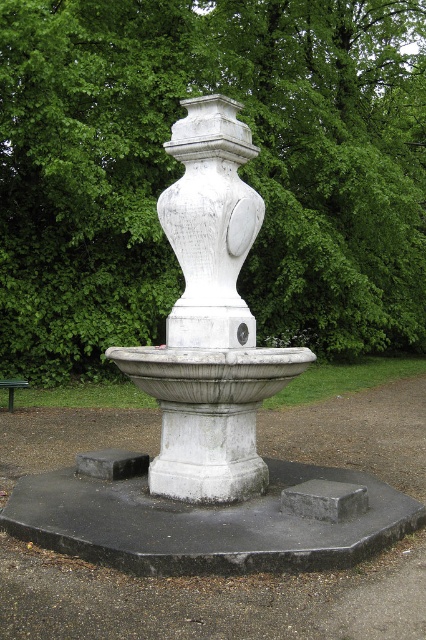
Is green leafy tree at upper center to the left of white stone vase at center from the viewer's perspective?

Incorrect, green leafy tree at upper center is not on the left side of white stone vase at center.

Identify the location of green leafy tree at upper center. The width and height of the screenshot is (426, 640). (181, 170).

Find the location of a particular element. Image resolution: width=426 pixels, height=640 pixels. green leafy tree at upper center is located at coordinates (181, 170).

Where is `green leafy tree at upper center`? The width and height of the screenshot is (426, 640). green leafy tree at upper center is located at coordinates (181, 170).

Is white marble fountain at center closer to camera compared to white stone vase at center?

Yes, it is in front of white stone vase at center.

Which is below, white marble fountain at center or white stone vase at center?

Positioned lower is white marble fountain at center.

Does point (169, 342) come behind point (215, 128)?

That is True.

Identify the location of white marble fountain at center. Image resolution: width=426 pixels, height=640 pixels. (210, 320).

Is point (201, 208) positioned behind point (9, 394)?

No, it is in front of (9, 394).

The image size is (426, 640). I want to click on white marble fountain at center, so click(210, 320).

The width and height of the screenshot is (426, 640). In order to click on white marble fountain at center in this screenshot , I will do `click(210, 320)`.